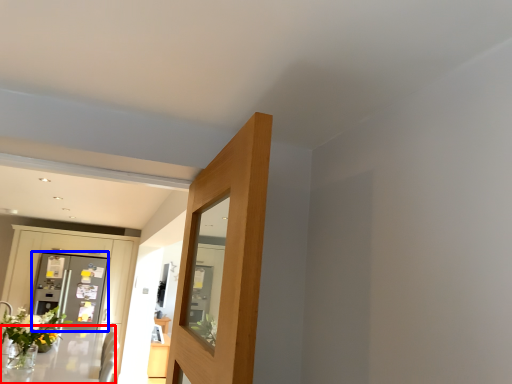
Question: Which point is further to the camera, table (highlighted by a red box) or screen door (highlighted by a blue box)?

Choices:
 (A) table
 (B) screen door

Answer: (B)